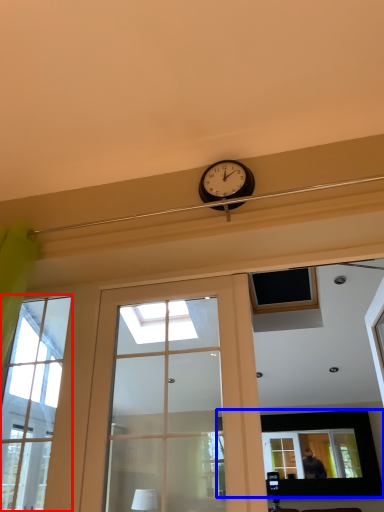
Question: Which of the following is the closest to the observer, window (highlighted by a red box) or picture frame (highlighted by a blue box)?

Choices:
 (A) window
 (B) picture frame

Answer: (A)